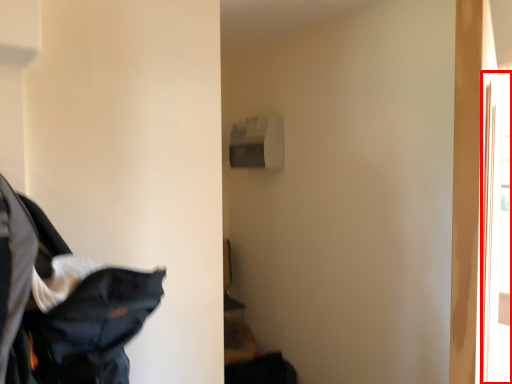
Question: From the image's perspective, where is screen door (annotated by the red box) located relative to laundry?

Choices:
 (A) above
 (B) below

Answer: (A)